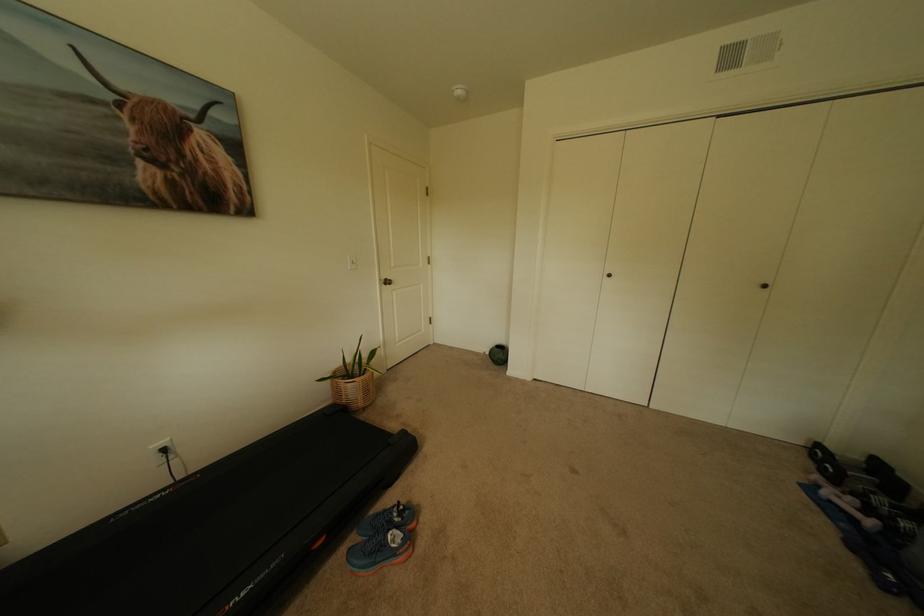
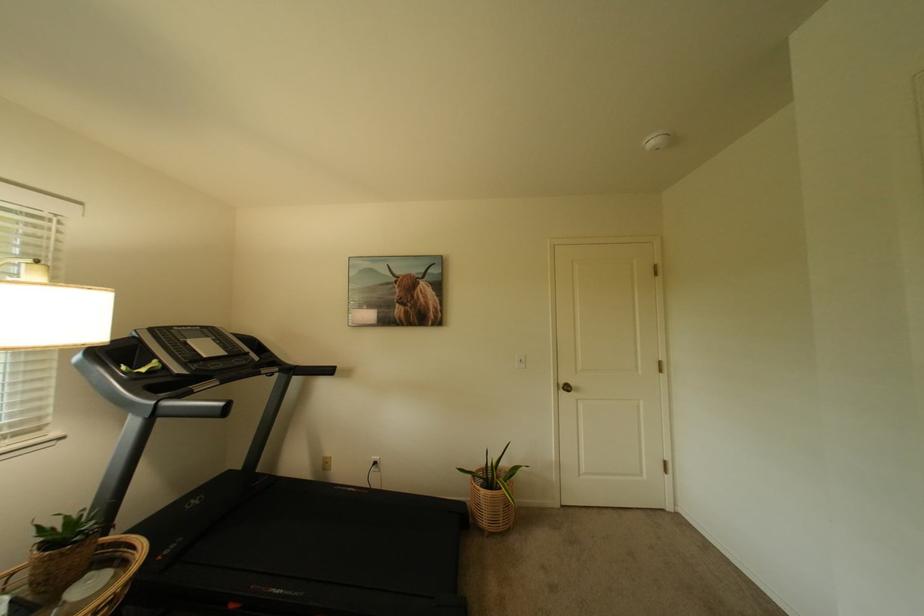
The point at (392, 282) is marked in the first image. Where is the corresponding point in the second image?

(569, 386)